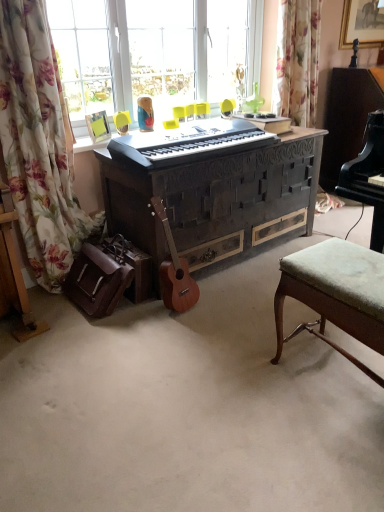
Where is `free region under green fabric stool at lower right (from a real-world perspective)`? The height and width of the screenshot is (512, 384). free region under green fabric stool at lower right (from a real-world perspective) is located at coordinates (336, 385).